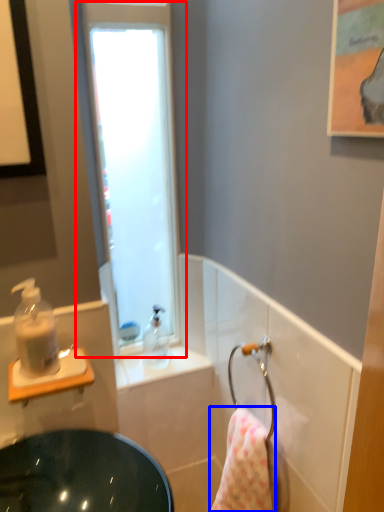
Question: Which of the following is the closest to the observer, window (highlighted by a red box) or bath towel (highlighted by a blue box)?

Choices:
 (A) window
 (B) bath towel

Answer: (B)